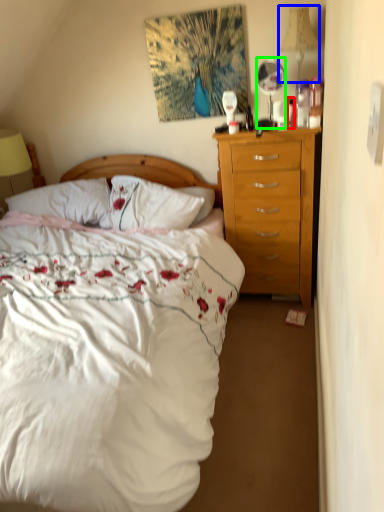
Question: Which is farther away from bottle (highlighted by a red box)? lamp (highlighted by a blue box) or mirror (highlighted by a green box)?

Choices:
 (A) lamp
 (B) mirror

Answer: (A)